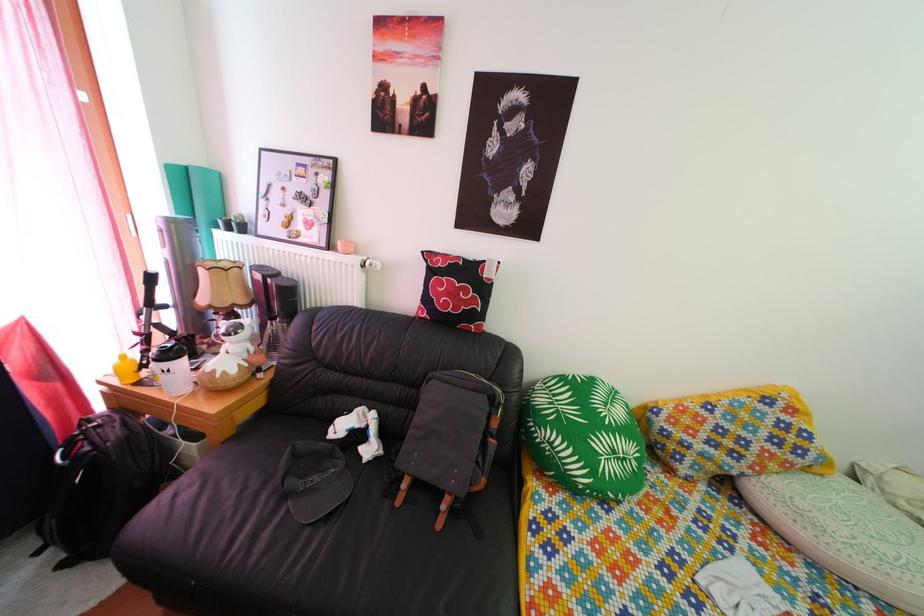
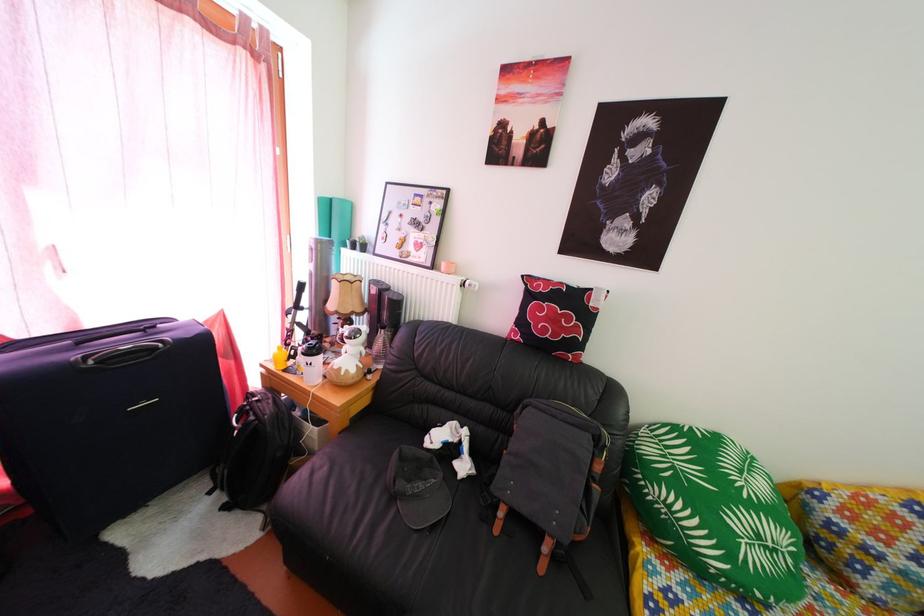
Locate, in the second image, the point that corresponds to [196,177] in the first image.

(339, 208)